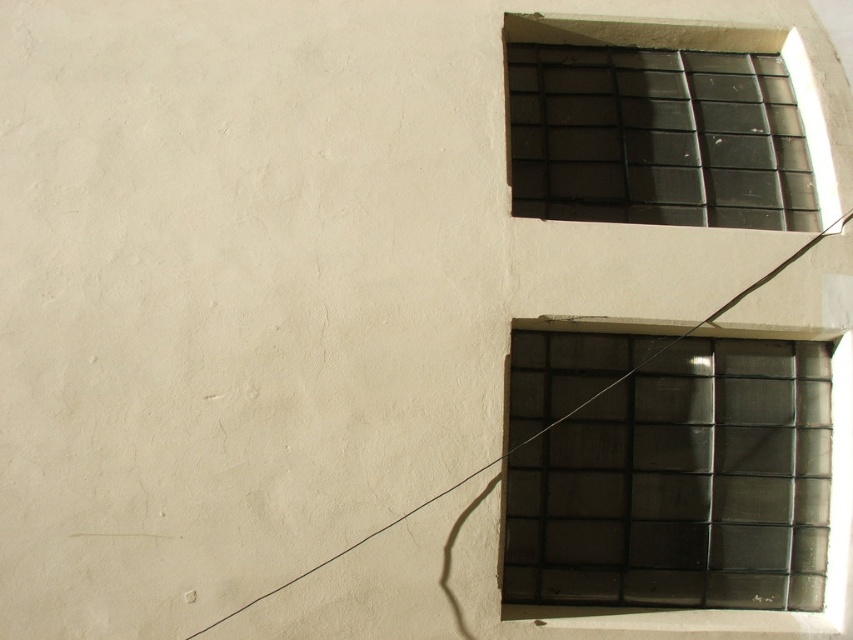
Does transparent glass window at upper right have a larger size compared to black glass window at upper right?

Incorrect, transparent glass window at upper right is not larger than black glass window at upper right.

Between transparent glass window at upper right and black glass window at upper right, which one is positioned lower?

transparent glass window at upper right is below.

Is point (611, 518) in front of point (833, 172)?

Yes, it is.

Identify the location of transparent glass window at upper right. (666, 472).